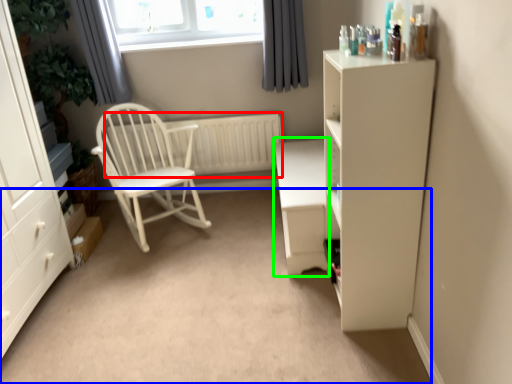
Question: Estimate the real-world distances between objects in this image. Which object is farther from radiator (highlighted by a red box), plain (highlighted by a blue box) or table (highlighted by a green box)?

Choices:
 (A) plain
 (B) table

Answer: (A)